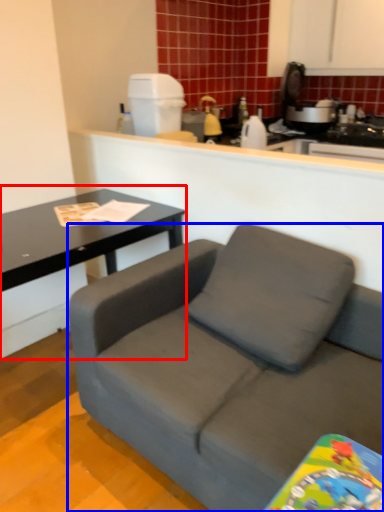
Question: Which of the following is the closest to the observer, coffee table (highlighted by a red box) or studio couch (highlighted by a blue box)?

Choices:
 (A) coffee table
 (B) studio couch

Answer: (B)